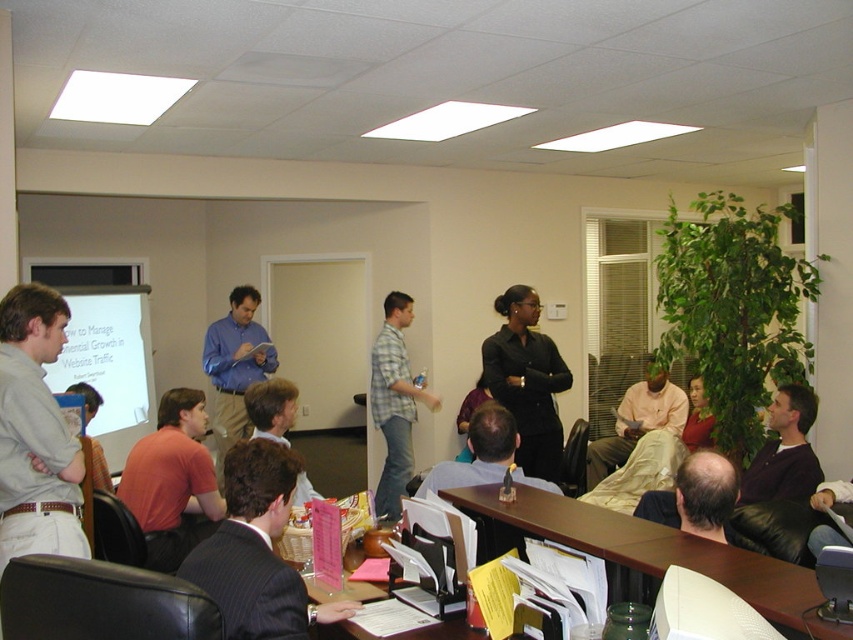
What do you see at coordinates (660, 552) in the screenshot? I see `brown wood table at lower center` at bounding box center [660, 552].

At what (x,y) coordinates should I click in order to perform the action: click on brown wood table at lower center. Please return your answer as a coordinate pair (x, y). Looking at the image, I should click on (660, 552).

Between light gray shirt at left and light brown leather jacket at center, which one has more height?

With more height is light gray shirt at left.

Who is more forward, (22,496) or (285,397)?

Point (22,496) is in front.

Measure the distance between light gray shirt at left and camera.

light gray shirt at left and camera are 2.24 meters apart from each other.

The image size is (853, 640). Find the location of `light gray shirt at left`. light gray shirt at left is located at coordinates (35, 433).

Who is more forward, (x=177, y=403) or (x=656, y=384)?

Point (x=177, y=403) is more forward.

Measure the distance between point [160,515] and camera.

Point [160,515] is 3.50 meters from camera.

Describe the element at coordinates (172, 481) in the screenshot. The width and height of the screenshot is (853, 640). I see `matte orange shirt at lower left` at that location.

What are the coordinates of `matte orange shirt at lower left` in the screenshot? It's located at (172, 481).